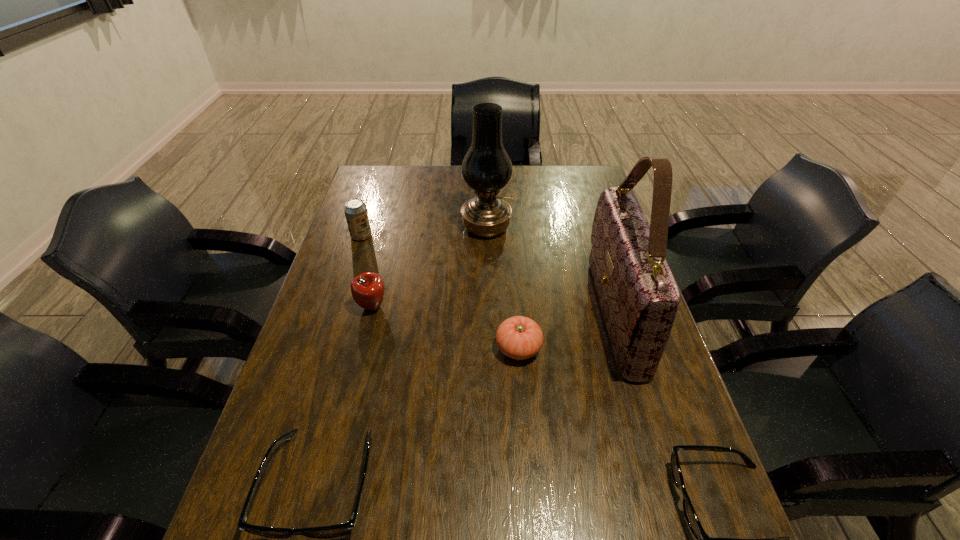
At what (x,y) coordinates should I click in order to perform the action: click on free space at the near left corner. Please return your answer as a coordinate pair (x, y). This screenshot has height=540, width=960. Looking at the image, I should click on (284, 464).

At what (x,y) coordinates should I click in order to perform the action: click on free space at the far right corner. Please return your answer as a coordinate pair (x, y). Image resolution: width=960 pixels, height=540 pixels. Looking at the image, I should click on (590, 173).

The height and width of the screenshot is (540, 960). I want to click on vacant space at the near right corner of the desktop, so point(669,477).

At what (x,y) coordinates should I click in order to perform the action: click on empty location between the handbag and the tomato. Please return your answer as a coordinate pair (x, y). The width and height of the screenshot is (960, 540). Looking at the image, I should click on (566, 331).

The image size is (960, 540). I want to click on vacant space that's between the apple and the tomato, so click(x=445, y=328).

You are a GUI agent. You are given a task and a screenshot of the screen. Output one action in this format:
    pyautogui.click(x=<x>, y=<y>)
    Task: Click on the free space between the oil lamp and the apple
    
    Given the screenshot: What is the action you would take?
    pyautogui.click(x=429, y=267)

Locate an element on the screen. free area in between the apple and the tomato is located at coordinates (445, 328).

Where is `free space between the beer can and the tomato`? free space between the beer can and the tomato is located at coordinates (440, 292).

Select which object is the closest to the beer can. Please provide its 2D coordinates. Your answer should be formatted as a tuple, i.e. [(x, y)], where the tuple contains the x and y coordinates of a point satisfying the conditions above.

[(367, 289)]

Locate which object is the second closest to the taller spectacles. Please provide its 2D coordinates. Your answer should be formatted as a tuple, i.e. [(x, y)], where the tuple contains the x and y coordinates of a point satisfying the conditions above.

[(367, 289)]